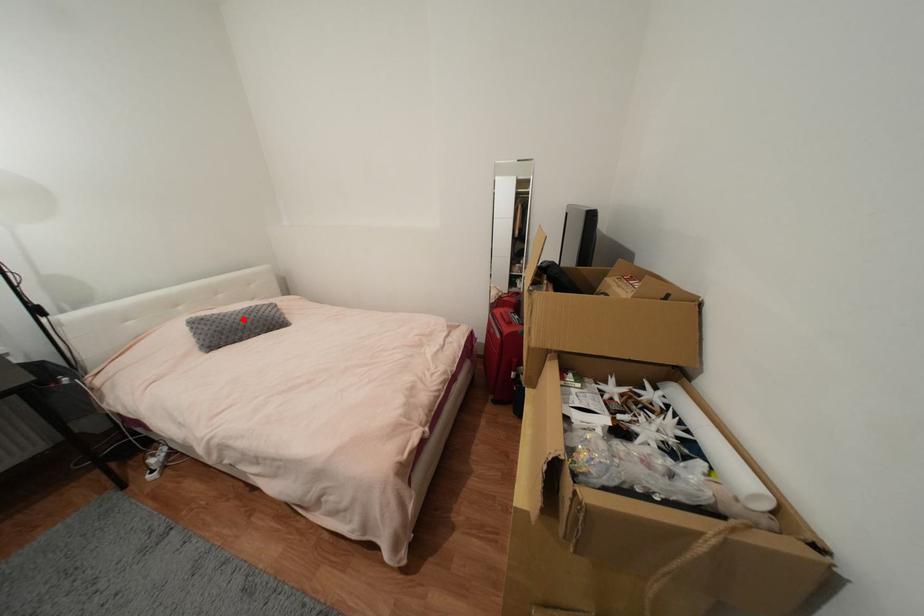
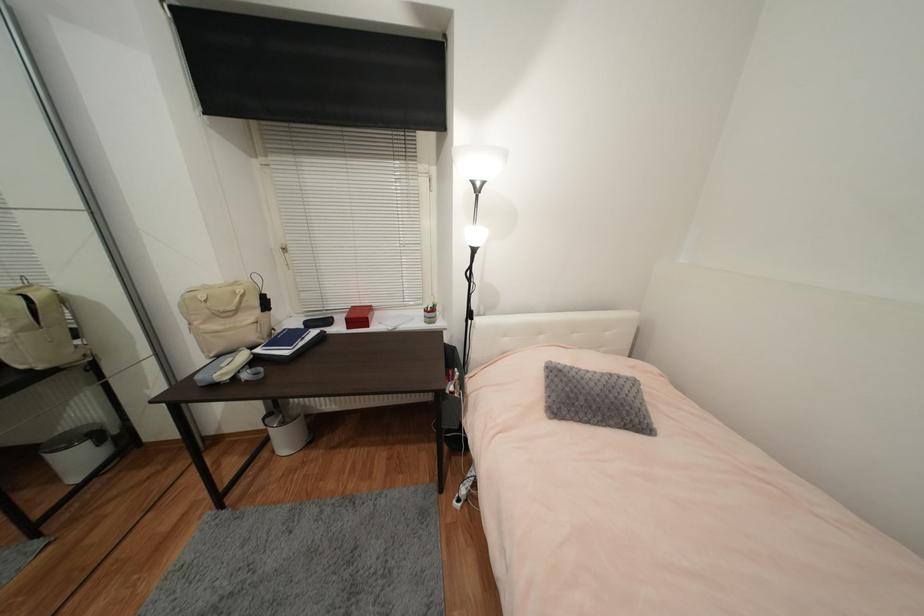
Locate, in the second image, the point that corresponds to the highlighted location in the first image.

(602, 391)